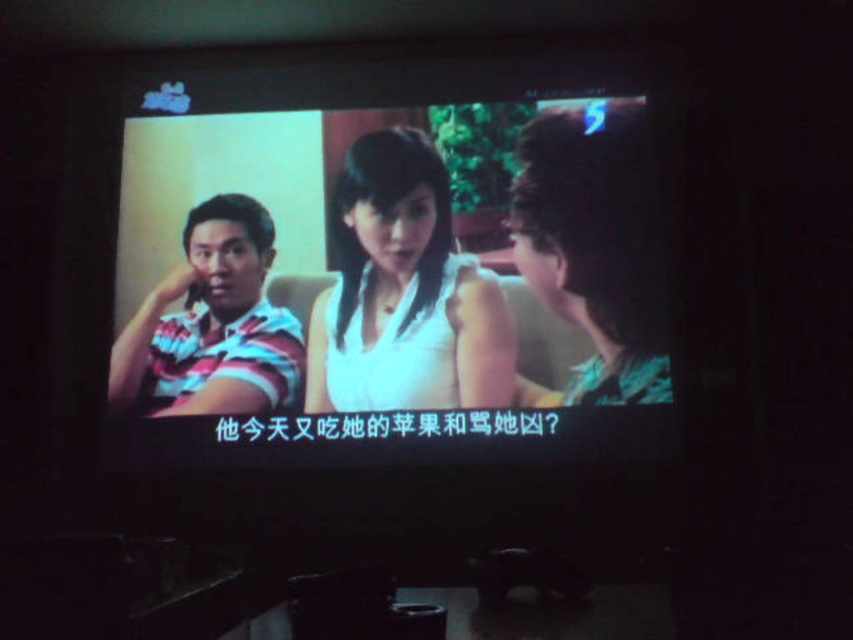
You are a character in the scene watching the screen. You need to move from point A at coordinates point (428,234) to point B at coordinates point (236,358). Can you walk directly from point A to point B without going through any objects?

Point (428,234) is behind point (236,358), so you would have to go around point (236,358) to reach point (428,234). Therefore, you cannot walk directly from point A to point B without passing through objects.